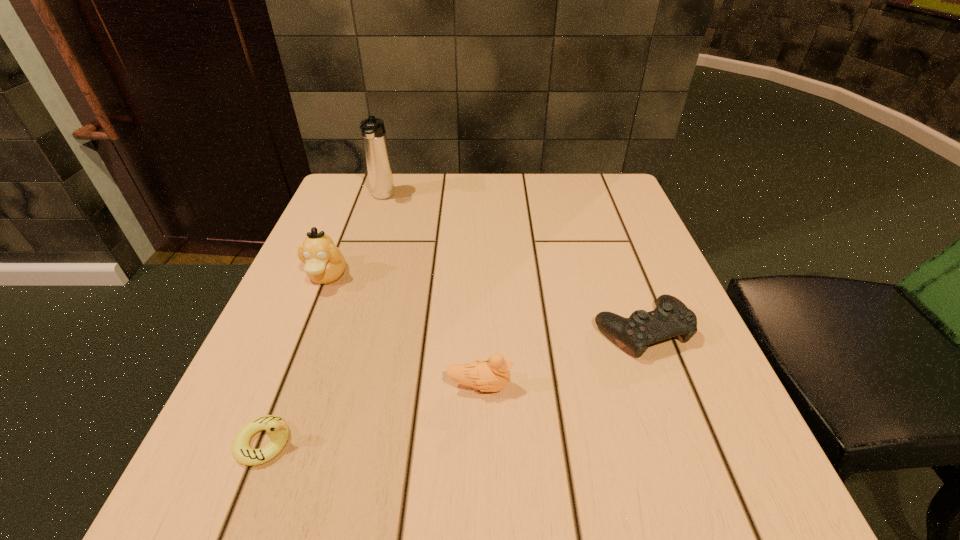
What are the coordinates of `object situated at the near left corner` in the screenshot? It's located at (277, 429).

In the image, there is a desktop. Where is `vacant space at the far edge`? Image resolution: width=960 pixels, height=540 pixels. vacant space at the far edge is located at coordinates (494, 188).

The height and width of the screenshot is (540, 960). In order to click on vacant space at the left edge of the desktop in this screenshot , I will do `click(344, 275)`.

The image size is (960, 540). In the image, there is a desktop. Find the location of `free region at the right edge`. free region at the right edge is located at coordinates (615, 246).

Where is `vacant area at the far left corner`? The height and width of the screenshot is (540, 960). vacant area at the far left corner is located at coordinates (348, 199).

Locate an element on the screen. This screenshot has height=540, width=960. free space at the near left corner of the desktop is located at coordinates (293, 525).

In the image, there is a desktop. Where is `vacant space at the far right corner`? The image size is (960, 540). vacant space at the far right corner is located at coordinates (605, 183).

Where is `free spot between the third farthest object and the shortest duckling`? The image size is (960, 540). free spot between the third farthest object and the shortest duckling is located at coordinates (453, 387).

You are a GUI agent. You are given a task and a screenshot of the screen. Output one action in this format:
    pyautogui.click(x=<x>, y=<y>)
    Task: Click on the vacant point located between the rightmost object and the nearest object
    The width and height of the screenshot is (960, 540).
    Given the screenshot: What is the action you would take?
    pyautogui.click(x=453, y=387)

Identify the location of vacant area that lies between the second farthest object and the thermos bottle. This screenshot has height=540, width=960. (355, 237).